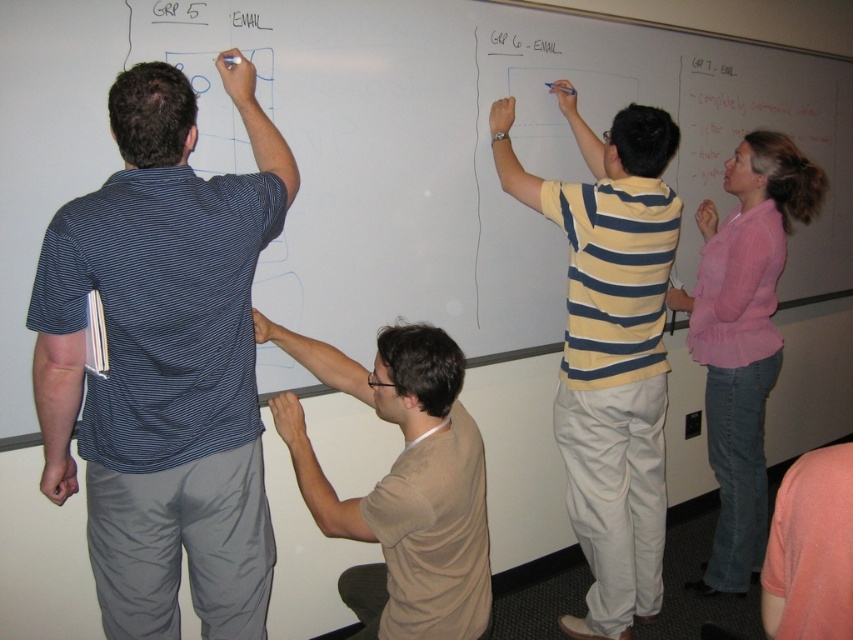
Question: Does whiteboard at left lie in front of brown cotton shirt at lower center?

Choices:
 (A) yes
 (B) no

Answer: (B)

Question: Is blue striped shirt at left wider than brown cotton shirt at lower center?

Choices:
 (A) yes
 (B) no

Answer: (B)

Question: Which object appears farthest from the camera in this image?

Choices:
 (A) pink linen blouse at upper right
 (B) yellow striped shirt at center

Answer: (A)

Question: Which object appears closest to the camera in this image?

Choices:
 (A) yellow striped shirt at center
 (B) pink linen blouse at upper right
 (C) blue striped shirt at left
 (D) brown cotton shirt at lower center

Answer: (C)

Question: Does blue striped shirt at left appear under yellow striped shirt at center?

Choices:
 (A) no
 (B) yes

Answer: (A)

Question: Which of the following is the closest to the observer?

Choices:
 (A) yellow striped shirt at center
 (B) pink linen blouse at upper right
 (C) blue striped shirt at left

Answer: (C)